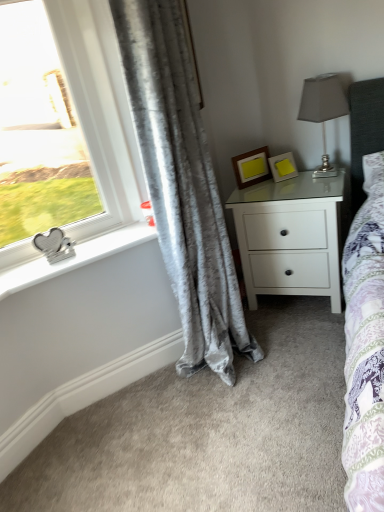
Locate an element on the screen. The width and height of the screenshot is (384, 512). free space between yellow matte picture frame at upper right, the second picture frame positioned from the left, and satin silver table lamp at upper right is located at coordinates (294, 181).